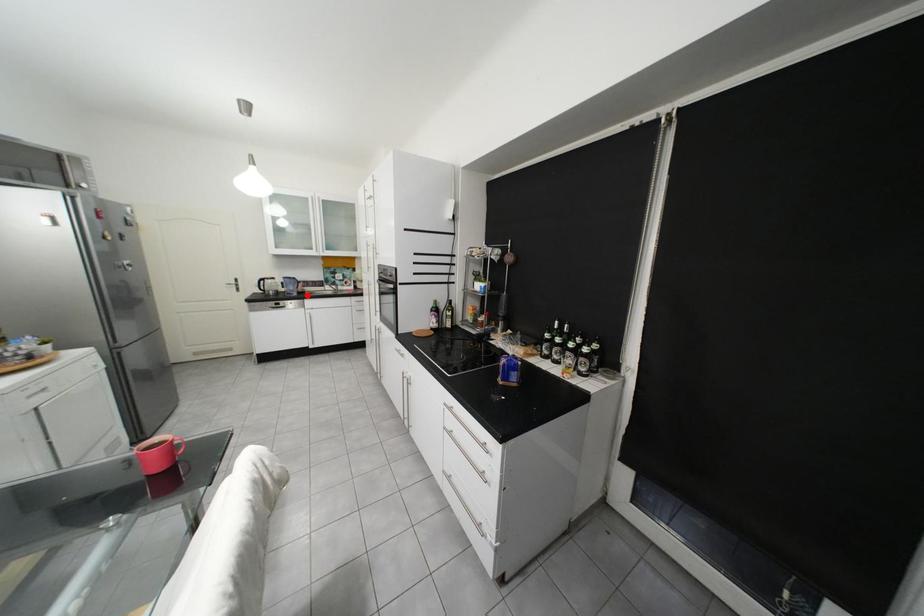
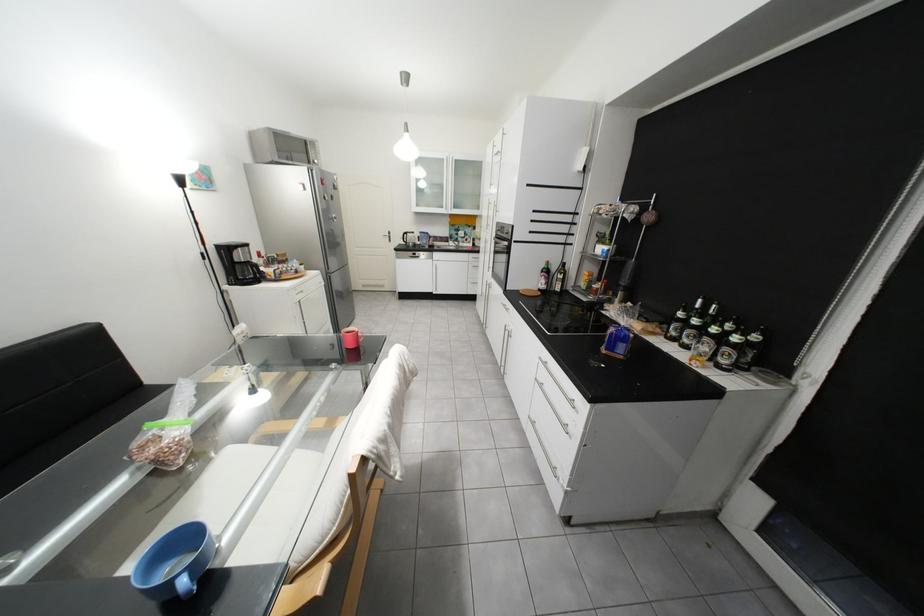
Question: I am providing you with two images of the same scene from different viewpoints. Given a red point in image1, look at the same physical point in image2. Is it:

Choices:
 (A) Closer to the viewpoint
 (B) Farther from the viewpoint

Answer: (A)